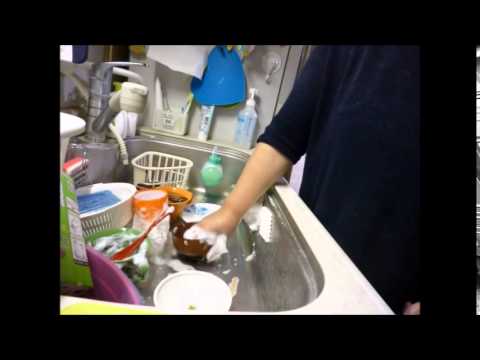
Find the location of a particular element. This screenshot has width=480, height=360. counter top is located at coordinates (350, 296).